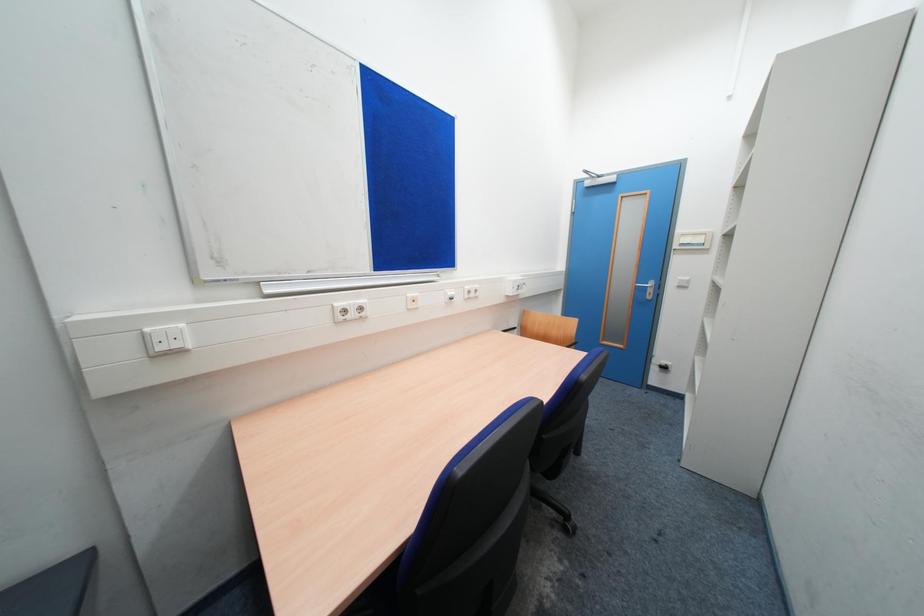
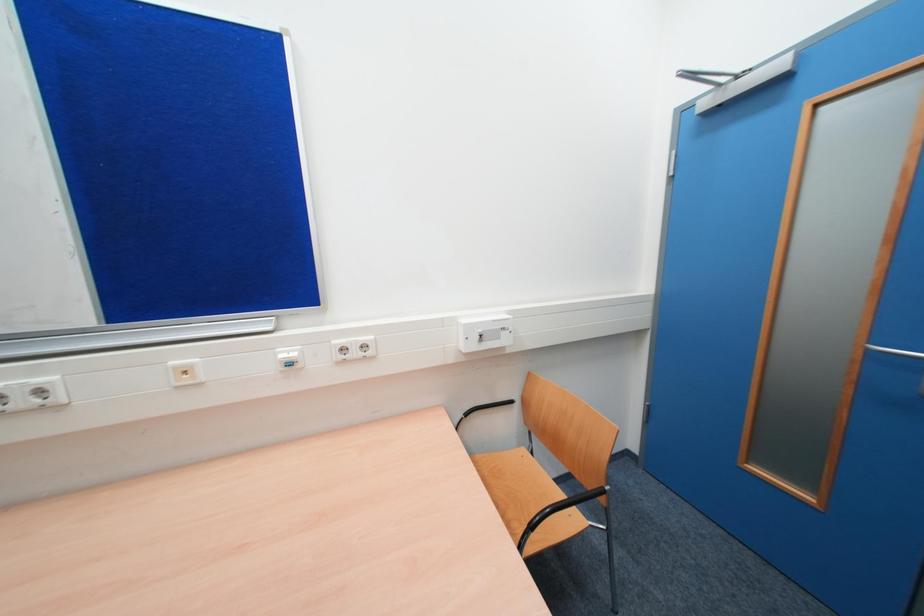
What movement of the cameraman would produce the second image?

The cameraman walked toward right, forward.